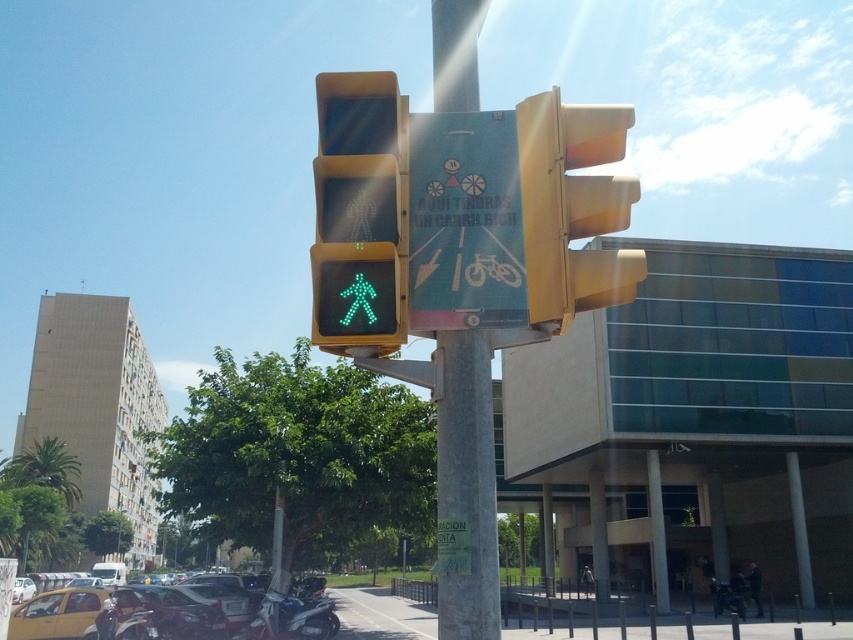
You are a pedestrian waiting to cross the street and see the blue paper sign at center and the green led pedestrian at center. Which one is positioned lower in the image?

The blue paper sign at center is located below the green led pedestrian at center, so the blue paper sign at center is positioned lower in the image.